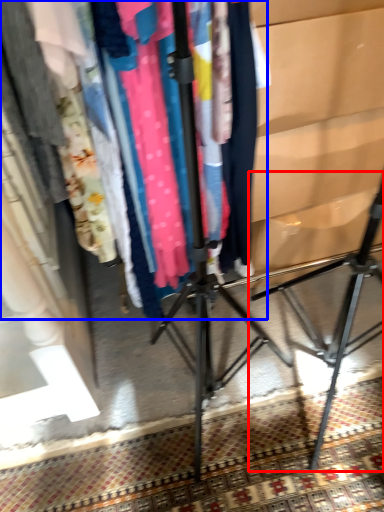
Question: Which point is closer to the camera, tripod (highlighted by a red box) or closet (highlighted by a blue box)?

Choices:
 (A) tripod
 (B) closet

Answer: (A)